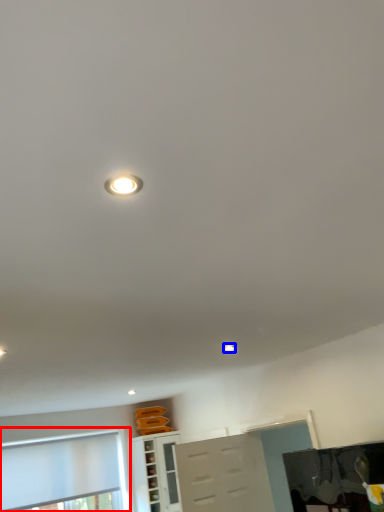
Question: Among these objects, which one is nearest to the camera, window (highlighted by a red box) or droplight (highlighted by a blue box)?

Choices:
 (A) window
 (B) droplight

Answer: (B)